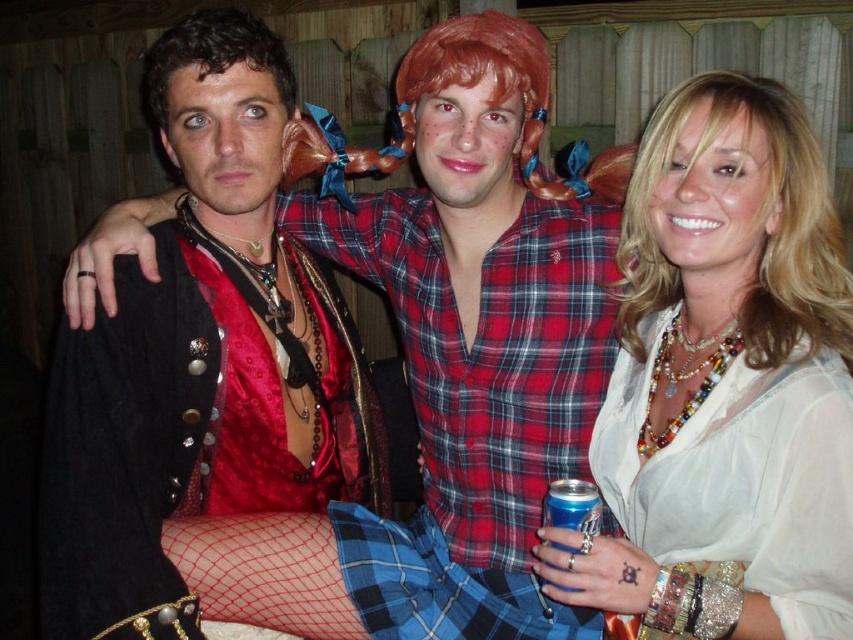
Question: Considering the real-world distances, which object is farthest from the shiny satin vest at left?

Choices:
 (A) blonde synthetic wig at upper right
 (B) curly brown hair at center

Answer: (A)

Question: Which of the following is the farthest from the observer?

Choices:
 (A) curly brown hair at center
 (B) blue metallic can at lower center

Answer: (A)

Question: Does shiny satin vest at left have a smaller size compared to blonde synthetic wig at upper right?

Choices:
 (A) yes
 (B) no

Answer: (B)

Question: Which is farther from the white beaded necklace at upper right?

Choices:
 (A) blue metallic can at lower center
 (B) blonde synthetic wig at upper right
 (C) shiny satin vest at left

Answer: (C)

Question: Can you confirm if white beaded necklace at upper right is smaller than blue metallic can at lower center?

Choices:
 (A) yes
 (B) no

Answer: (B)

Question: Is blonde synthetic wig at upper right above curly brown hair at center?

Choices:
 (A) no
 (B) yes

Answer: (A)